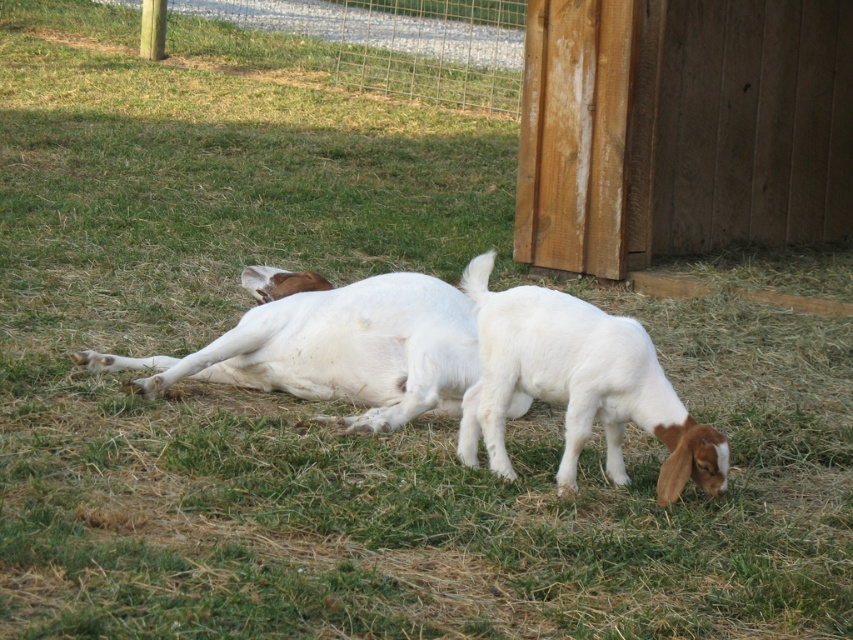
You are a farmer checking the fence around your goats. You notice the wire mesh fence at upper center and the white soft fur goat at center. Which object is bigger in size?

The wire mesh fence at upper center is larger in size compared to the white soft fur goat at center.

You are standing at the origin point in the image. You want to walk towards the white soft fur goat at center. Which direction should you move in the image?

You should move towards the right and down in the image to reach the white soft fur goat at center, as its 2D location is at point [339,349].

You are a farmer checking the boundaries of your property. You notice a wire mesh fence at upper center and a white fluffy goat at lower right. Based on their sizes in the image, which one do you think is wider?

The wire mesh fence at upper center might be wider than white fluffy goat at lower right.